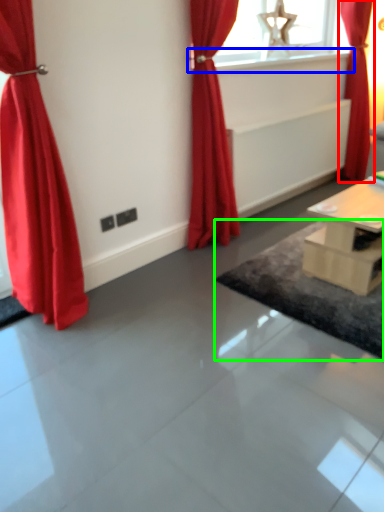
Question: Considering the real-world distances, which object is closest to curtain (highlighted by a red box)? window sill (highlighted by a blue box) or mat (highlighted by a green box).

Choices:
 (A) window sill
 (B) mat

Answer: (A)